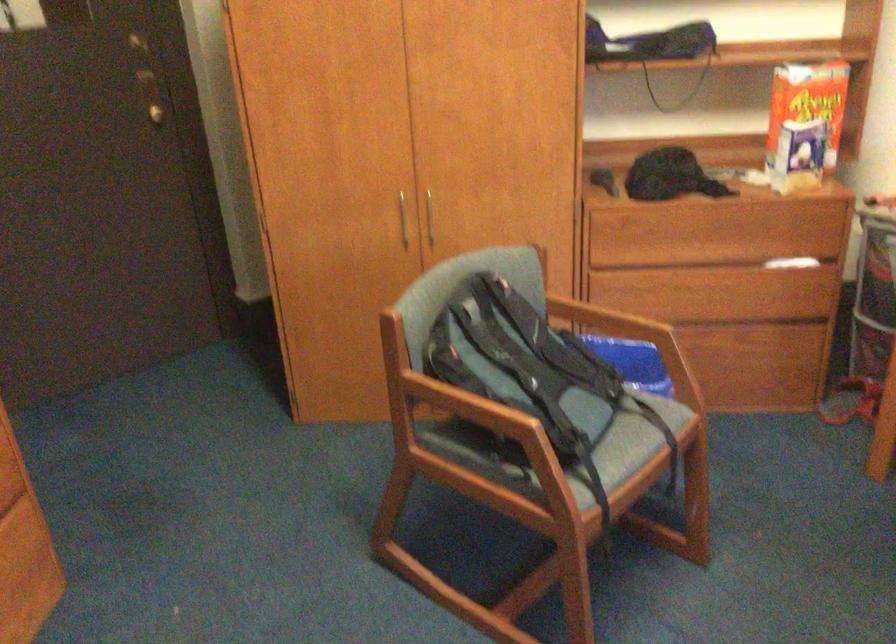
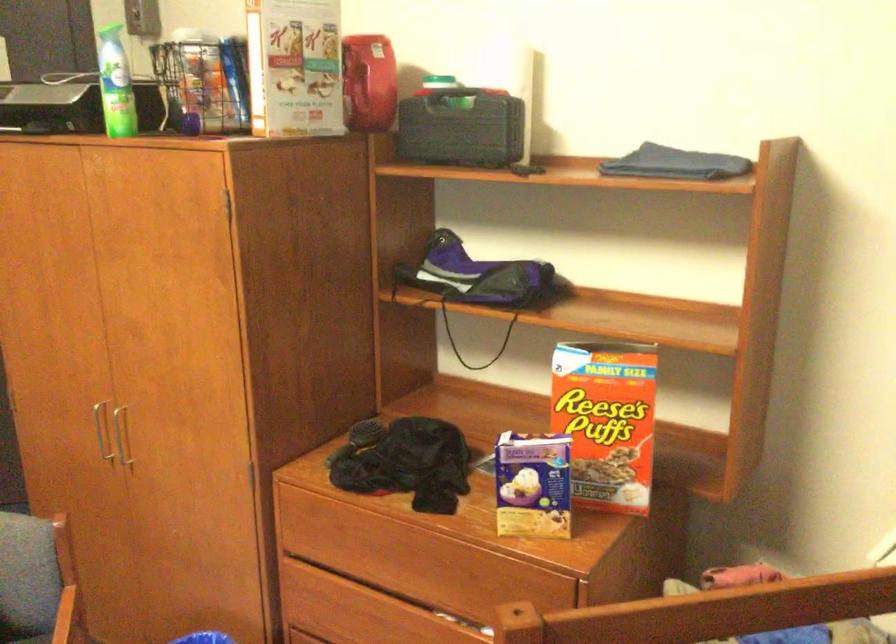
What movement of the cameraman would produce the second image?

The cameraman walked toward right, forward.